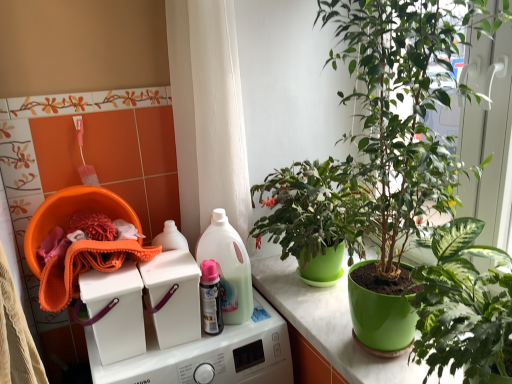
This screenshot has width=512, height=384. What are the coordinates of `free spot to the right of pink glossy spray can at center` in the screenshot? It's located at (246, 323).